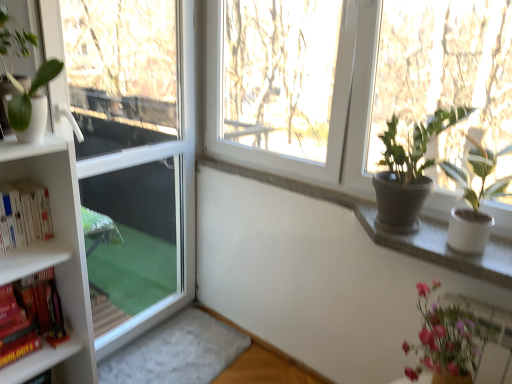
Question: Is white ceramic pot at upper right at the right side of pink glossy vase at lower right, acting as the first houseplant starting from the right?

Choices:
 (A) no
 (B) yes

Answer: (B)

Question: Is white ceramic pot at upper right looking in the opposite direction of pink glossy vase at lower right, the 3th houseplant when ordered from left to right?

Choices:
 (A) no
 (B) yes

Answer: (A)

Question: From a real-world perspective, is white ceramic pot at upper right located beneath pink glossy vase at lower right, the 3th houseplant when ordered from left to right?

Choices:
 (A) no
 (B) yes

Answer: (A)

Question: Would you consider white ceramic pot at upper right to be distant from pink glossy vase at lower right, which is the 3th houseplant from top to bottom?

Choices:
 (A) no
 (B) yes

Answer: (A)

Question: Can you confirm if white ceramic pot at upper right is shorter than pink glossy vase at lower right, the 3th houseplant when ordered from left to right?

Choices:
 (A) no
 (B) yes

Answer: (B)

Question: Can you confirm if white ceramic pot at upper right is smaller than pink glossy vase at lower right, the 3th houseplant when ordered from left to right?

Choices:
 (A) yes
 (B) no

Answer: (A)

Question: Considering the relative positions of matte white pot at left, which is the third houseplant in bottom-to-top order, and hardcover books at left, which is the 2th book in bottom-to-top order, in the image provided, is matte white pot at left, which is the third houseplant in bottom-to-top order, to the right of hardcover books at left, which is the 2th book in bottom-to-top order, from the viewer's perspective?

Choices:
 (A) no
 (B) yes

Answer: (B)

Question: From a real-world perspective, does matte white pot at left, acting as the 1th houseplant starting from the left, sit lower than hardcover books at left, which is the 2th book in bottom-to-top order?

Choices:
 (A) no
 (B) yes

Answer: (A)

Question: From the image's perspective, is matte white pot at left, which is the third houseplant in bottom-to-top order, located beneath hardcover books at left, which is the 2th book in bottom-to-top order?

Choices:
 (A) yes
 (B) no

Answer: (B)

Question: Is matte white pot at left, which is the third houseplant in bottom-to-top order, turned away from hardcover books at left, which is the 2th book in bottom-to-top order?

Choices:
 (A) no
 (B) yes

Answer: (A)

Question: Does matte white pot at left, placed as the third houseplant when sorted from right to left, touch hardcover books at left, which is the 2th book in bottom-to-top order?

Choices:
 (A) yes
 (B) no

Answer: (B)

Question: Is matte white pot at left, which ranks as the 1th houseplant in top-to-bottom order, thinner than hardcover books at left, placed as the 1th book when sorted from top to bottom?

Choices:
 (A) yes
 (B) no

Answer: (B)

Question: Is pink glossy vase at lower right, which is the 3th houseplant from top to bottom, smaller than matte gray pot at upper right, placed as the second houseplant when sorted from right to left?

Choices:
 (A) yes
 (B) no

Answer: (B)